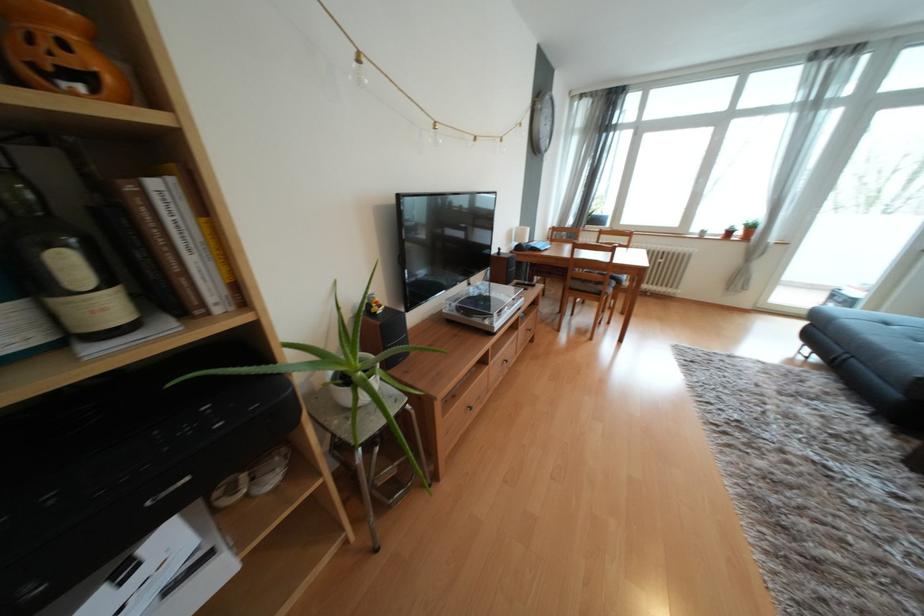
You are a GUI agent. You are given a task and a screenshot of the screen. Output one action in this format:
    pyautogui.click(x=<x>, y=<y>)
    Task: Click on the drawer handle
    This screenshot has width=924, height=616.
    Given the screenshot: What is the action you would take?
    pyautogui.click(x=468, y=408)